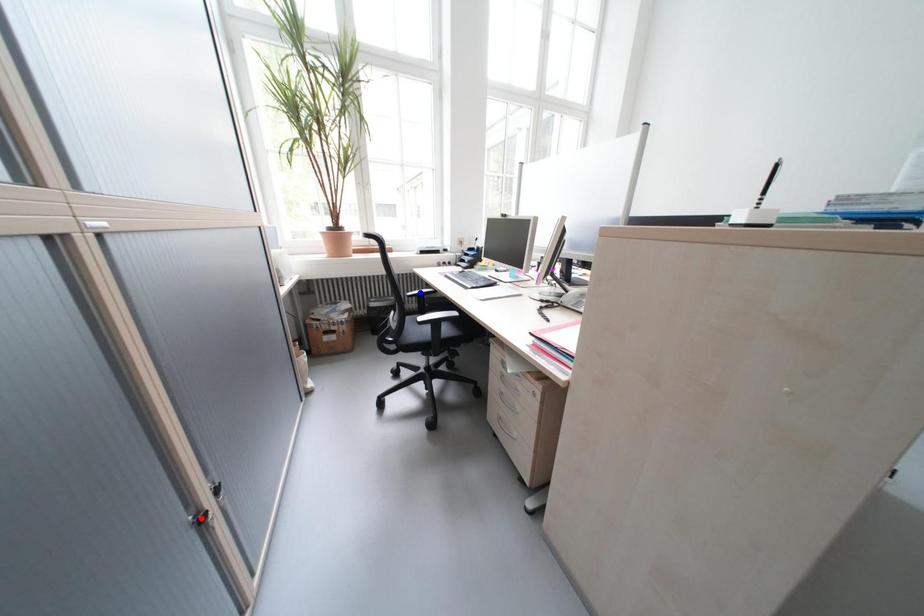
Question: In the image, two points are highlighted. Which point is nearer to the camera? Reply with the corresponding letter.

Choices:
 (A) blue point
 (B) red point

Answer: (B)